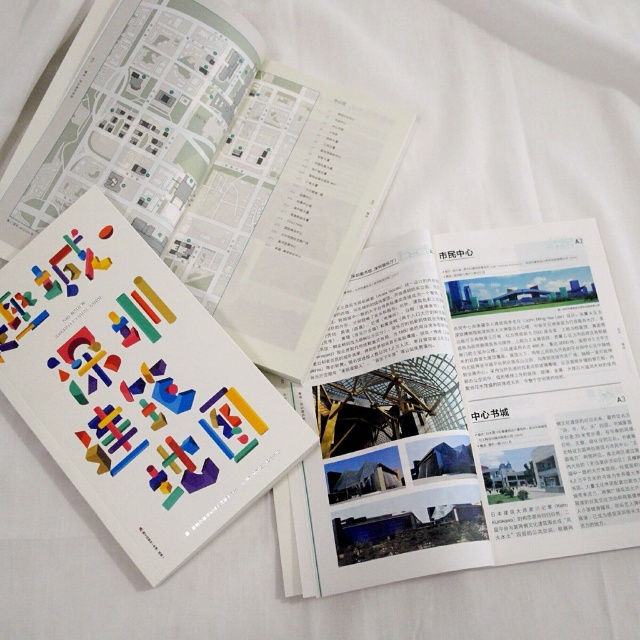
You are organizing a display of design materials and need to place the white paper at upper center and the multicolored plastic book at center. If you want to create a hierarchy where the larger item is placed above the smaller one, which item should be positioned higher?

The multicolored plastic book at center is larger than the white paper at upper center, so it should be positioned higher to create the desired hierarchy.

You are an interior designer who wants to place both the multicolored plastic book at center and the colorful paper cutouts at center on a shelf. The shelf has a width of 1 meter. If you want to place them side by side without overlapping, will they fit?

The multicolored plastic book at center is wider than the colorful paper cutouts at center, but their combined width is not specified. However, since the shelf is 1 meter wide, and the book is larger, it depends on their individual widths. Without exact measurements, we cannot confirm if they will fit side by side without overlapping.